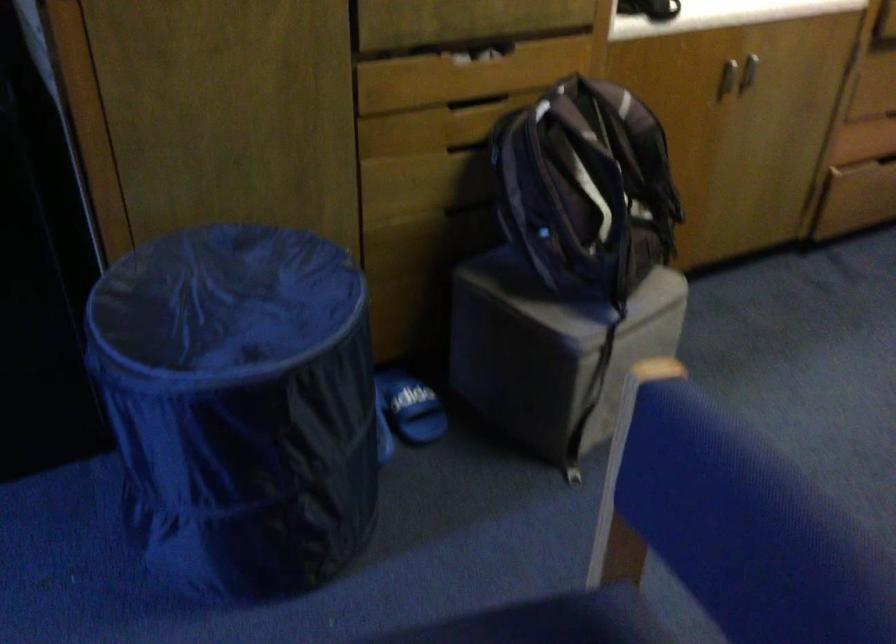
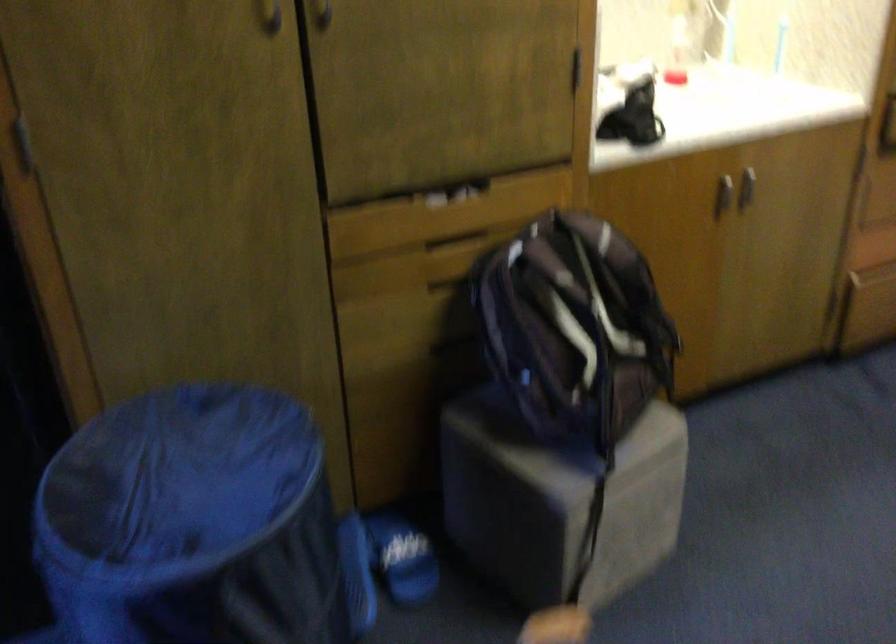
Question: I am providing you with two images of the same scene from different viewpoints. After the viewpoint changes to image2, which objects are now occluded?

Choices:
 (A) silver cabinet handle
 (B) blue slide sandal
 (C) backpack strap
 (D) none of these

Answer: (D)